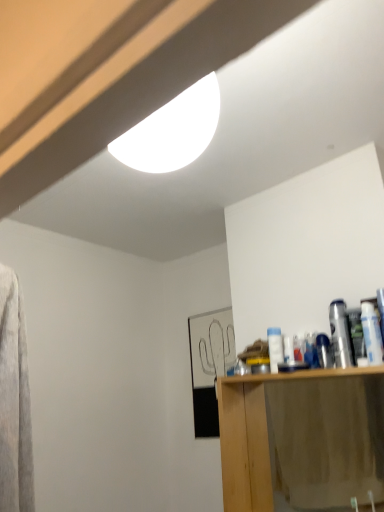
Question: Should I look upward or downward to see wooden cabinet at lower right?

Choices:
 (A) down
 (B) up

Answer: (A)